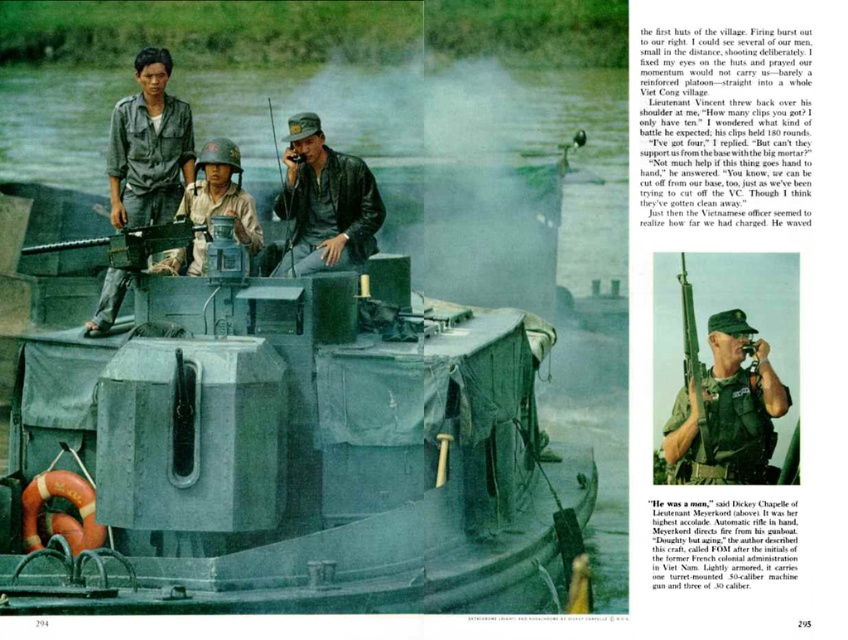
Question: Does camouflage fabric uniform at center lie in front of matte black rifle at center?

Choices:
 (A) no
 (B) yes

Answer: (A)

Question: Which point appears farthest from the camera in this image?

Choices:
 (A) (378, 221)
 (B) (448, 516)

Answer: (A)

Question: Which object is farther from the camera taking this photo?

Choices:
 (A) camouflage fabric jacket at center
 (B) camouflage fabric uniform at center

Answer: (A)

Question: Does camouflage fabric helmet at center appear under matte black rifle at center?

Choices:
 (A) yes
 (B) no

Answer: (B)

Question: Is camouflage fabric uniform at upper left to the right of camouflage fabric jacket at center from the viewer's perspective?

Choices:
 (A) no
 (B) yes

Answer: (A)

Question: Among these points, which one is nearest to the camera?

Choices:
 (A) (143, 100)
 (B) (250, 241)
 (C) (698, 433)

Answer: (C)